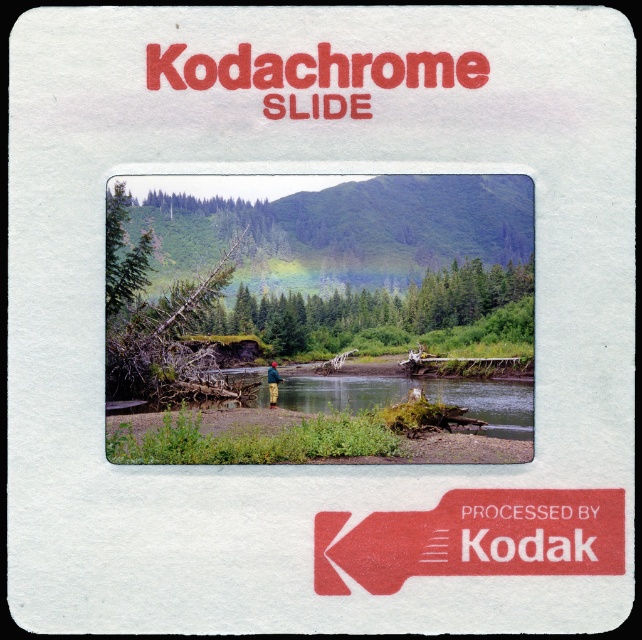
You are an observer looking at the vintage Kodachrome slide. You notice the green grassy river at center and the green woolen hat at center. Which object is wider in the slide?

The green grassy river at center is wider than the green woolen hat at center.

You are standing at the point marked by the coordinates point (x=512, y=394) in the scene. A hiker wants to know how far they are from you. Can you tell them the distance?

The point marked by the coordinates point (x=512, y=394) is 53.77 meters away from the viewer, so the hiker is 53.77 meters away from you.